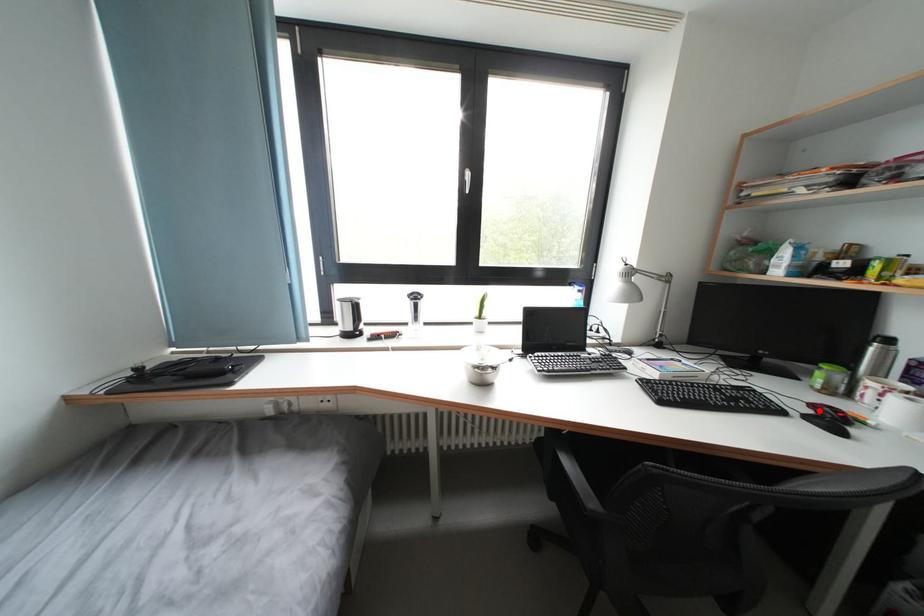
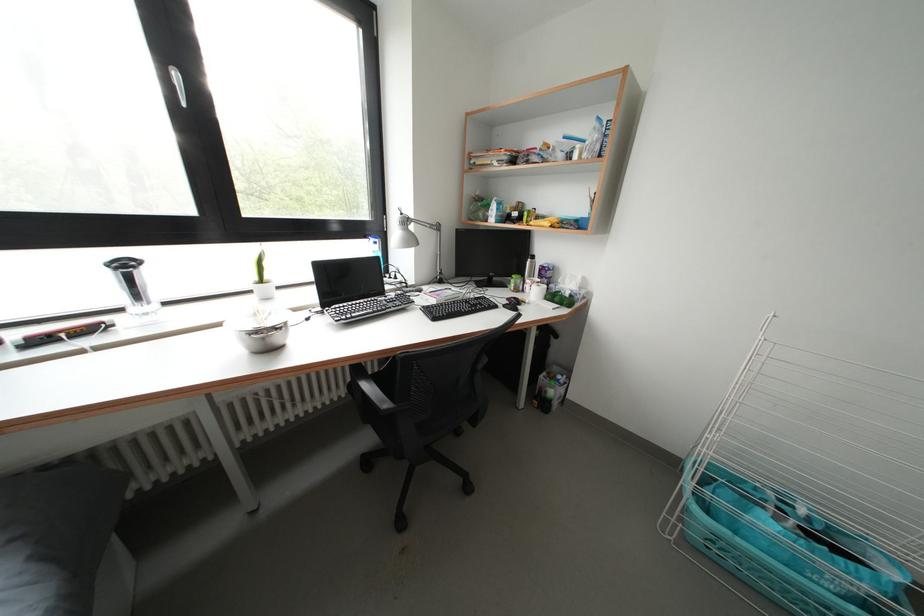
Find the pixel in the second image that matches the highlighted location in the first image.

(515, 304)